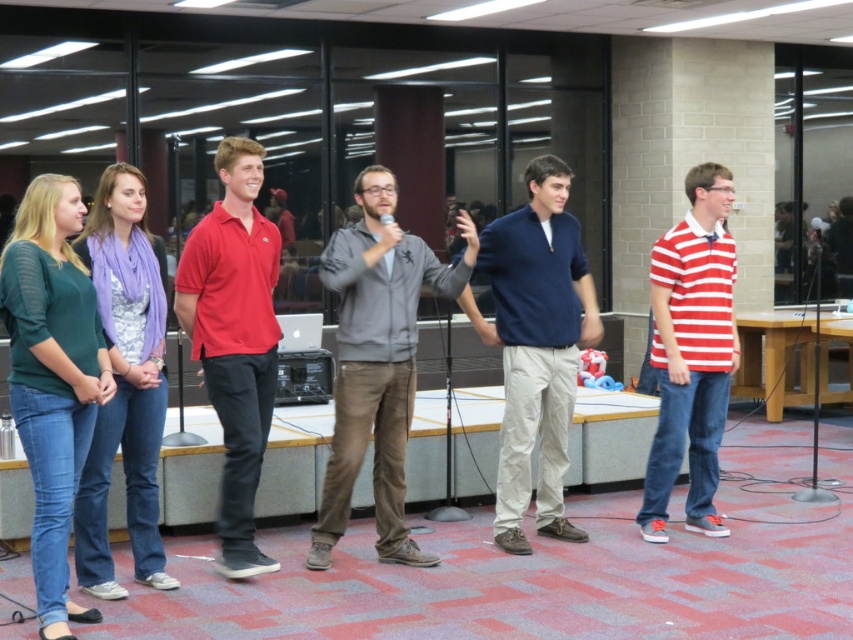
In the scene described, there is a point at coordinates (125, 385). Which object in the image does this point correspond to?

The point at coordinates (125, 385) corresponds to the purple scarf at left.

You are standing in the office and need to locate the purple scarf at left. According to the coordinates provided, where exactly is it positioned?

The purple scarf at left is located at point 0.602 on the x axis and 0.147 on the y axis.